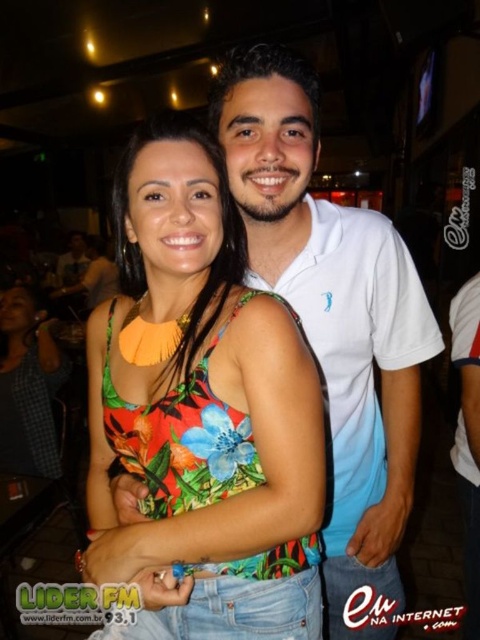
Between point (170, 189) and point (377, 572), which one is positioned behind?

Positioned behind is point (377, 572).

Can you confirm if floral fabric top at center is wider than white cotton polo shirt at center?

Yes, floral fabric top at center is wider than white cotton polo shirt at center.

Identify the location of floral fabric top at center. The width and height of the screenshot is (480, 640). (203, 406).

Where is `floral fabric top at center`? floral fabric top at center is located at coordinates (203, 406).